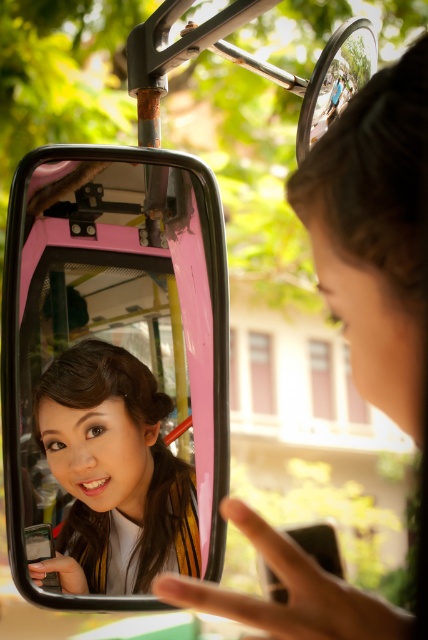
Question: In this image, where is pink glossy rearview mirror at upper center located relative to matte black phone at center?

Choices:
 (A) above
 (B) below

Answer: (B)

Question: Is pink glossy rearview mirror at upper center smaller than matte black phone at center?

Choices:
 (A) no
 (B) yes

Answer: (A)

Question: Which point is farther to the camera?

Choices:
 (A) matte black phone at center
 (B) pink glossy rearview mirror at upper center
 (C) matte black hair at center

Answer: (C)

Question: Estimate the real-world distances between objects in this image. Which object is farther from the pink glossy rearview mirror at upper center?

Choices:
 (A) matte black phone at center
 (B) matte black hair at center

Answer: (A)

Question: Is pink glossy rearview mirror at upper center further to the viewer compared to matte black hair at center?

Choices:
 (A) yes
 (B) no

Answer: (B)

Question: Which of the following is the closest to the observer?

Choices:
 (A) (107, 403)
 (B) (213, 602)
 (C) (190, 477)

Answer: (B)